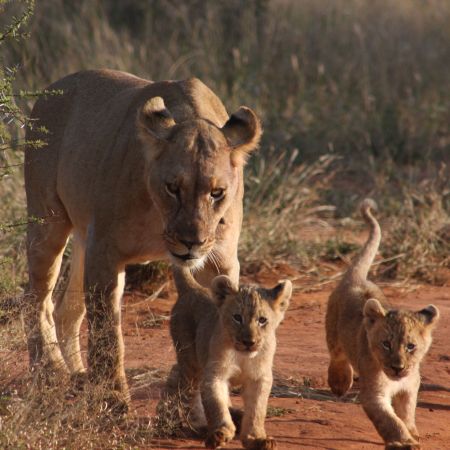
Find the location of a particular element. family photo is located at coordinates (258, 308).